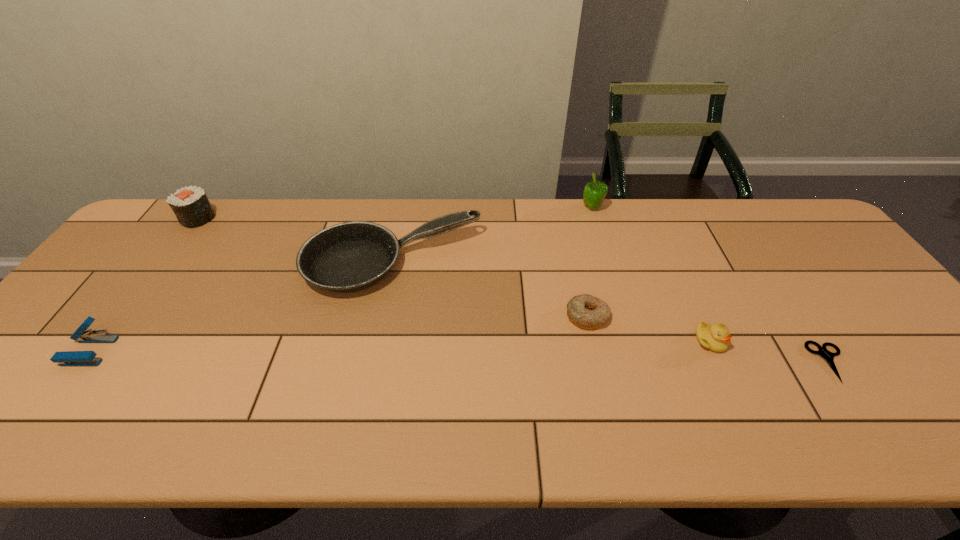
Identify the location of free region that satisfies the following two spatial constraints: 1. on the back side of the tallest object; 2. on the left side of the fifth object from right to left. (403, 208).

In order to click on vacant space that satisfies the following two spatial constraints: 1. on the back side of the tallest object; 2. on the left side of the frying pan in this screenshot , I will do `click(403, 208)`.